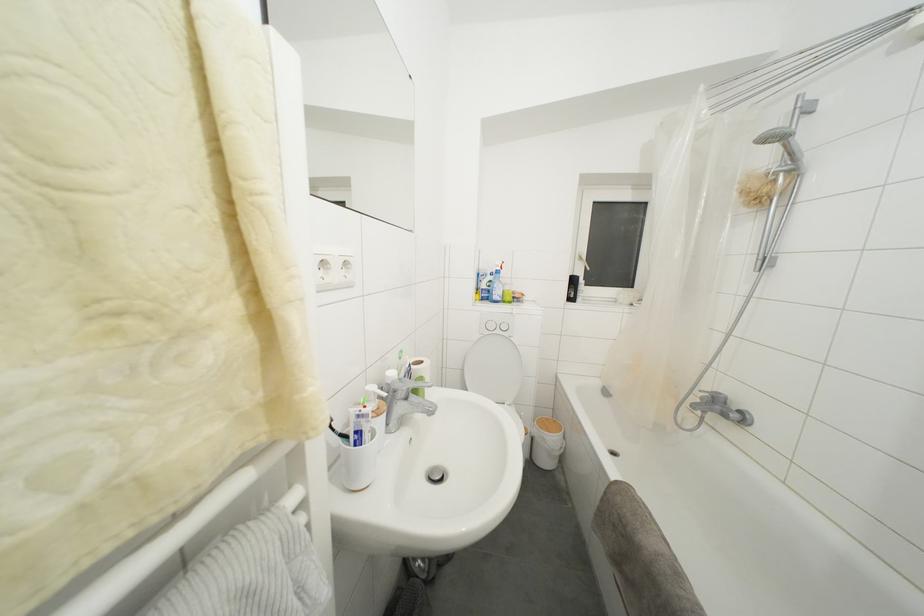
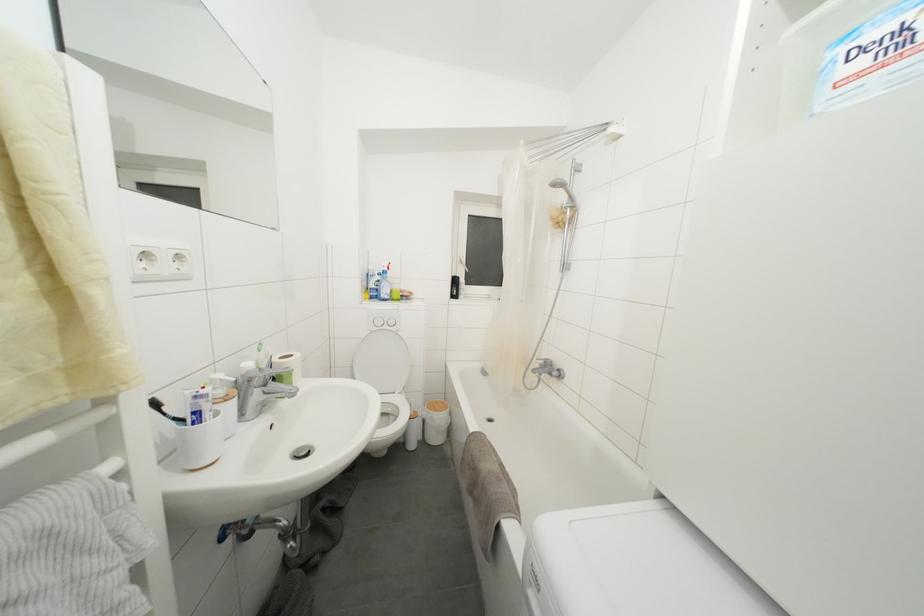
Find the pixel in the second image that matches (371,440) in the first image.

(211, 419)